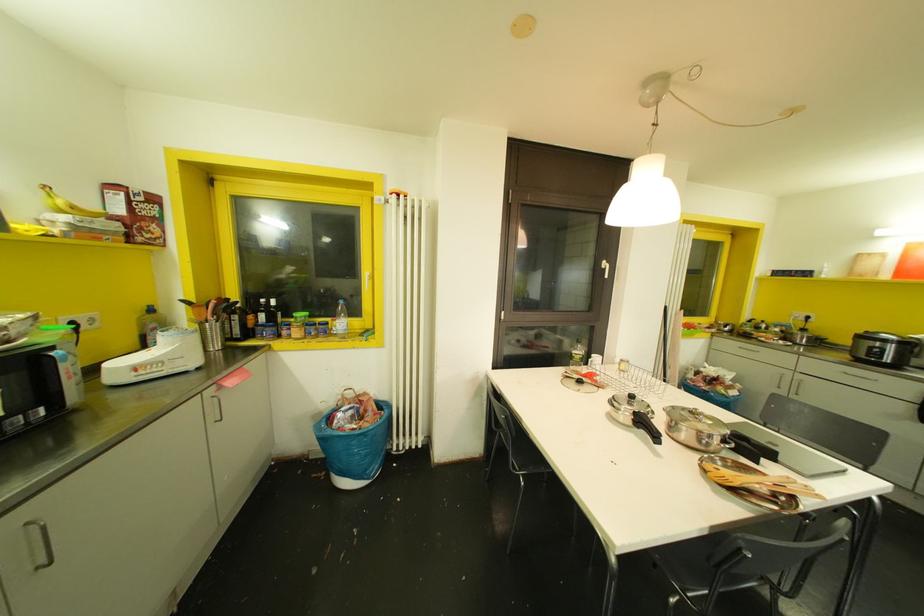
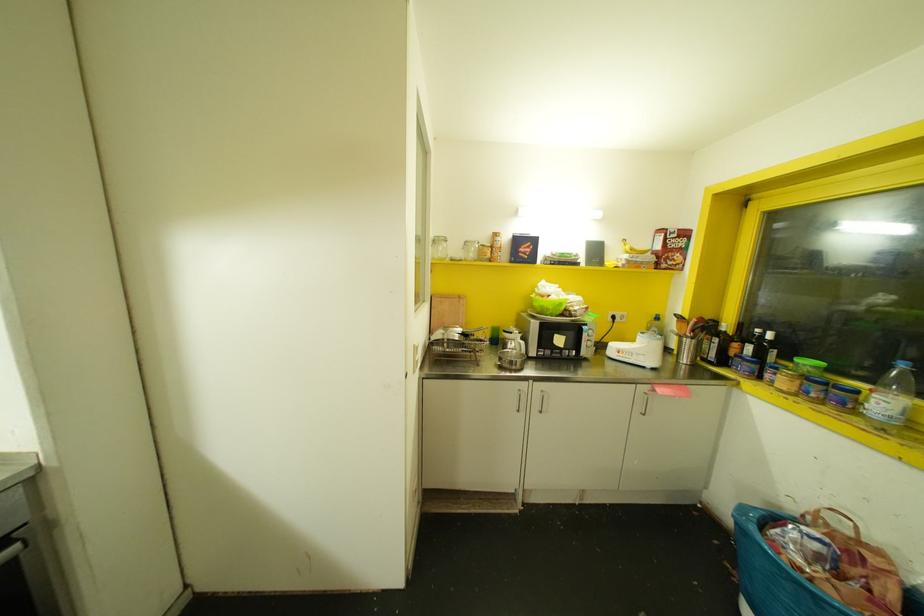
Where in the second image is the point corresponding to point 341,301 from the first image?

(902, 363)